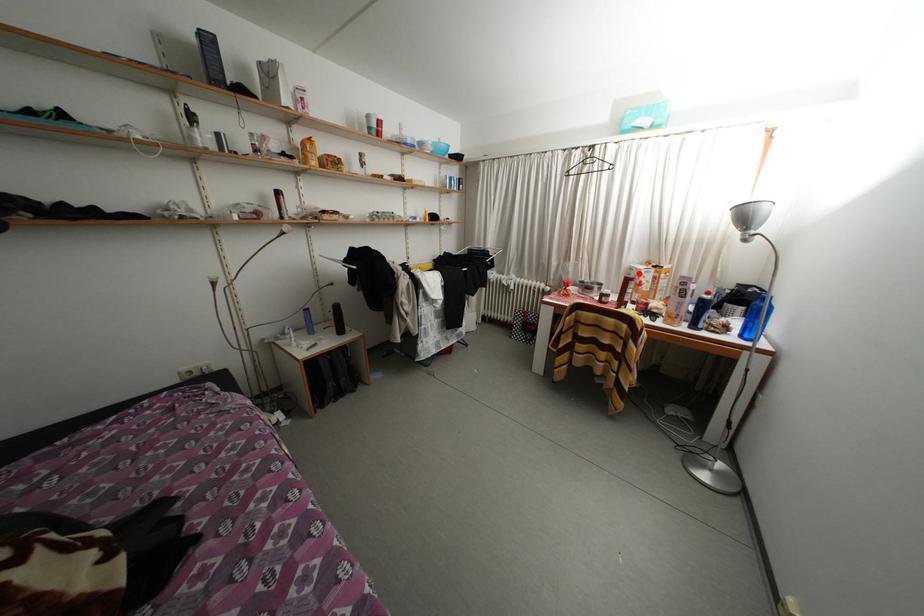
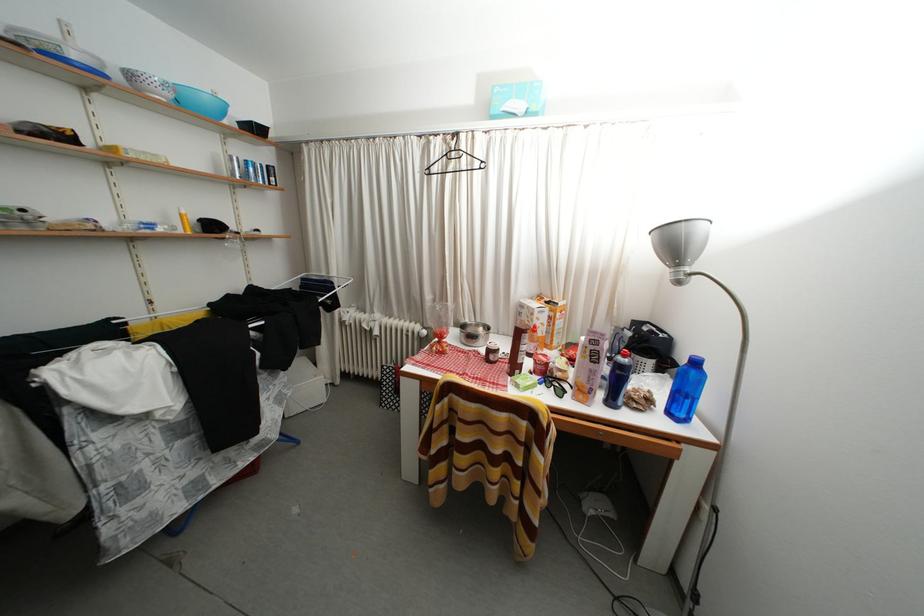
Question: I am providing you with two images of the same scene from different viewpoints. Given a red point in image1, look at the same physical point in image2. Is it:

Choices:
 (A) Closer to the viewpoint
 (B) Farther from the viewpoint

Answer: (B)